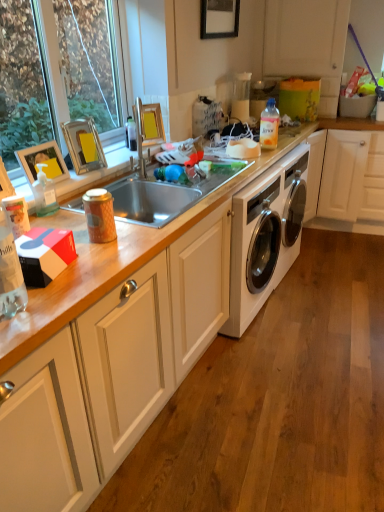
Describe the element at coordinates (269, 125) in the screenshot. The height and width of the screenshot is (512, 384). I see `translucent plastic bottle at upper right, marked as the 1th bottle in a right-to-left arrangement` at that location.

What do you see at coordinates (56, 71) in the screenshot? I see `clear glass window at upper left` at bounding box center [56, 71].

This screenshot has height=512, width=384. What do you see at coordinates (83, 145) in the screenshot? I see `silver metallic picture frame at upper left, marked as the second picture frame in a front-to-back arrangement` at bounding box center [83, 145].

Describe the element at coordinates (150, 123) in the screenshot. I see `yellow cardboard picture frame at upper center, acting as the second picture frame starting from the top` at that location.

I want to click on translucent plastic bottle at upper right, marked as the 1th bottle in a right-to-left arrangement, so 269,125.

From a real-world perspective, which object stands above the other?

From a 3D spatial view, yellow cardboard picture frame at upper center, which appears as the 3th picture frame when viewed from the front, is above.

From the image's perspective, which is below, translucent plastic bottle at upper right, which is counted as the first bottle, starting from the back, or yellow cardboard picture frame at upper center, which appears as the 3th picture frame when viewed from the front?

yellow cardboard picture frame at upper center, which appears as the 3th picture frame when viewed from the front, is shown below in the image.

Considering the relative positions of translucent plastic bottle at upper right, marked as the 1th bottle in a right-to-left arrangement, and yellow cardboard picture frame at upper center, which appears as the 3th picture frame when viewed from the front, in the image provided, is translucent plastic bottle at upper right, marked as the 1th bottle in a right-to-left arrangement, to the right of yellow cardboard picture frame at upper center, which appears as the 3th picture frame when viewed from the front, from the viewer's perspective?

Yes, translucent plastic bottle at upper right, marked as the 1th bottle in a right-to-left arrangement, is to the right of yellow cardboard picture frame at upper center, which appears as the 3th picture frame when viewed from the front.

Considering the points (263, 139) and (151, 110), which point is behind, point (263, 139) or point (151, 110)?

Positioned behind is point (263, 139).

Consider the image. Does metallic silver picture frame at upper left, marked as the first picture frame in a front-to-back arrangement, have a larger size compared to white matte cabinet at upper right, positioned as the 2th cabinetry in bottom-to-top order?

No, metallic silver picture frame at upper left, marked as the first picture frame in a front-to-back arrangement, is not bigger than white matte cabinet at upper right, positioned as the 2th cabinetry in bottom-to-top order.

Would you say metallic silver picture frame at upper left, the fourth picture frame in the right-to-left sequence, is to the left or to the right of white matte cabinet at upper right, positioned as the 2th cabinetry in bottom-to-top order, in the picture?

metallic silver picture frame at upper left, the fourth picture frame in the right-to-left sequence, is positioned on white matte cabinet at upper right, positioned as the 2th cabinetry in bottom-to-top order,'s left side.

How many degrees apart are the facing directions of metallic silver picture frame at upper left, marked as the first picture frame in a front-to-back arrangement, and white matte cabinet at upper right, positioned as the first cabinetry in top-to-bottom order?

The angular difference between metallic silver picture frame at upper left, marked as the first picture frame in a front-to-back arrangement, and white matte cabinet at upper right, positioned as the first cabinetry in top-to-bottom order, is 85.1 degrees.

Based on the photo, based on their positions, is black matte picture frame at upper center, the 4th picture frame ordered from the bottom, located to the left or right of translucent plastic bottle at left, the second bottle positioned from the top?

Clearly, black matte picture frame at upper center, the 4th picture frame ordered from the bottom, is on the right of translucent plastic bottle at left, the second bottle positioned from the top, in the image.

Which object is closer to the camera, black matte picture frame at upper center, the fourth picture frame in the left-to-right sequence, or translucent plastic bottle at left, which appears as the 2th bottle when viewed from the back?

Positioned in front is translucent plastic bottle at left, which appears as the 2th bottle when viewed from the back.

From a real-world perspective, is black matte picture frame at upper center, the 4th picture frame ordered from the bottom, above or below translucent plastic bottle at left, which appears as the 2th bottle when viewed from the back?

Clearly, from a real-world perspective, black matte picture frame at upper center, the 4th picture frame ordered from the bottom, is above translucent plastic bottle at left, which appears as the 2th bottle when viewed from the back.

Between point (236, 31) and point (39, 182), which one is positioned in front?

Point (39, 182)

The width and height of the screenshot is (384, 512). In order to click on cabinetry on the left of translucent plastic bottle at upper right, which appears as the 1th bottle when viewed from the top in this screenshot , I will do (x=111, y=373).

In the scene shown: Considering the sizes of white matte cabinet at lower left, acting as the 1th cabinetry starting from the bottom, and translucent plastic bottle at upper right, which is the second bottle from left to right, in the image, is white matte cabinet at lower left, acting as the 1th cabinetry starting from the bottom, taller or shorter than translucent plastic bottle at upper right, which is the second bottle from left to right,?

white matte cabinet at lower left, acting as the 1th cabinetry starting from the bottom, is shorter than translucent plastic bottle at upper right, which is the second bottle from left to right.

Is point (61, 459) behind point (275, 127)?

No, (61, 459) is in front of (275, 127).

Who is bigger, silver metallic picture frame at upper left, marked as the second picture frame in a front-to-back arrangement, or yellow cardboard picture frame at upper center, placed as the third picture frame when sorted from left to right?

Bigger between the two is silver metallic picture frame at upper left, marked as the second picture frame in a front-to-back arrangement.

From a real-world perspective, is silver metallic picture frame at upper left, the 3th picture frame from the top, physically below yellow cardboard picture frame at upper center, which is counted as the 2th picture frame, starting from the right?

Actually, silver metallic picture frame at upper left, the 3th picture frame from the top, is physically above yellow cardboard picture frame at upper center, which is counted as the 2th picture frame, starting from the right, in the real world.

Between point (83, 160) and point (144, 115), which one is positioned behind?

Positioned behind is point (144, 115).

Is silver metallic picture frame at upper left, positioned as the 3th picture frame in right-to-left order, facing away from yellow cardboard picture frame at upper center, which is counted as the 2th picture frame, starting from the right?

That's not correct — silver metallic picture frame at upper left, positioned as the 3th picture frame in right-to-left order, is not looking away from yellow cardboard picture frame at upper center, which is counted as the 2th picture frame, starting from the right.

How different are the orientations of clear glass window at upper left and translucent plastic bottle at left, the second bottle positioned from the top, in degrees?

clear glass window at upper left and translucent plastic bottle at left, the second bottle positioned from the top, are facing 0.468 degrees away from each other.

From a real-world perspective, which object rests below the other?

translucent plastic bottle at left, the first bottle in the left-to-right sequence, from a real-world perspective.

Considering the sizes of clear glass window at upper left and translucent plastic bottle at left, the second bottle positioned from the top, in the image, is clear glass window at upper left bigger or smaller than translucent plastic bottle at left, the second bottle positioned from the top,?

In the image, clear glass window at upper left appears to be larger than translucent plastic bottle at left, the second bottle positioned from the top.

Is point (164, 392) more distant than point (252, 195)?

No, (164, 392) is in front of (252, 195).

Is white matte cabinet at lower left, acting as the 1th cabinetry starting from the bottom, to the left or to the right of white glossy washing machine at center in the image?

white matte cabinet at lower left, acting as the 1th cabinetry starting from the bottom, is positioned on white glossy washing machine at center's left side.

In the scene shown: Which object is thinner, white matte cabinet at lower left, the 2th cabinetry viewed from the top, or white glossy washing machine at center?

white glossy washing machine at center is thinner.

Identify the location of bottle behind the yellow cardboard picture frame at upper center, which is counted as the 2th picture frame, starting from the right. (269, 125).

Which picture frame is the 4th one when counting from the front of the white matte cabinet at upper right, positioned as the 2th cabinetry in bottom-to-top order? Please provide its 2D coordinates.

[(43, 162)]

Based on their spatial positions, is white matte cabinet at lower left, the 2th cabinetry viewed from the top, or translucent plastic bottle at left, which appears as the 2th bottle when viewed from the back, further from metallic silver picture frame at upper left, the fourth picture frame in the right-to-left sequence?

white matte cabinet at lower left, the 2th cabinetry viewed from the top, is further to metallic silver picture frame at upper left, the fourth picture frame in the right-to-left sequence.

Which object lies nearer to the anchor point white matte cabinet at lower left, acting as the 1th cabinetry starting from the bottom, metallic silver picture frame at upper left, marked as the first picture frame in a bottom-to-top arrangement, or silver metallic picture frame at upper left, which is the 2th picture frame in left-to-right order?

Based on the image, metallic silver picture frame at upper left, marked as the first picture frame in a bottom-to-top arrangement, appears to be nearer to white matte cabinet at lower left, acting as the 1th cabinetry starting from the bottom.

Based on their spatial positions, is white matte cabinet at upper right, positioned as the 2th cabinetry in bottom-to-top order, or black matte picture frame at upper center, which is the 4th picture frame in front-to-back order, closer to silver metallic picture frame at upper left, which is the 2th picture frame in left-to-right order?

Result: Among the two, black matte picture frame at upper center, which is the 4th picture frame in front-to-back order, is located nearer to silver metallic picture frame at upper left, which is the 2th picture frame in left-to-right order.

Estimate the real-world distances between objects in this image. Which object is closer to translucent plastic bottle at upper right, which is counted as the first bottle, starting from the back, black matte picture frame at upper center, which is the 4th picture frame in front-to-back order, or white matte cabinet at lower left, acting as the 1th cabinetry starting from the bottom?

black matte picture frame at upper center, which is the 4th picture frame in front-to-back order, is closer to translucent plastic bottle at upper right, which is counted as the first bottle, starting from the back.

Which object lies nearer to the anchor point yellow cardboard picture frame at upper center, placed as the third picture frame when sorted from left to right, metallic silver picture frame at upper left, which is the 1th picture frame in left-to-right order, or white matte cabinet at lower left, acting as the 1th cabinetry starting from the bottom?

metallic silver picture frame at upper left, which is the 1th picture frame in left-to-right order, lies closer to yellow cardboard picture frame at upper center, placed as the third picture frame when sorted from left to right, than the other object.

Based on their spatial positions, is metallic silver picture frame at upper left, which is the fourth picture frame from back to front, or white matte cabinet at upper right, positioned as the 2th cabinetry in bottom-to-top order, closer to translucent plastic bottle at left, the first bottle in the left-to-right sequence?

The object closer to translucent plastic bottle at left, the first bottle in the left-to-right sequence, is metallic silver picture frame at upper left, which is the fourth picture frame from back to front.

Which object lies further to the anchor point white glossy washing machine at center, yellow cardboard picture frame at upper center, which is counted as the 2th picture frame, starting from the right, or translucent plastic bottle at left, the second bottle positioned from the top?

Among the two, translucent plastic bottle at left, the second bottle positioned from the top, is located further to white glossy washing machine at center.

Estimate the real-world distances between objects in this image. Which object is closer to yellow cardboard picture frame at upper center, placed as the third picture frame when sorted from left to right, black matte picture frame at upper center, acting as the 1th picture frame starting from the back, or clear glass window at upper left?

clear glass window at upper left lies closer to yellow cardboard picture frame at upper center, placed as the third picture frame when sorted from left to right, than the other object.

Where is `washing machine located between metallic silver picture frame at upper left, the fourth picture frame in the right-to-left sequence, and translucent plastic bottle at upper right, which is counted as the second bottle, starting from the front, in the left-right direction`? This screenshot has height=512, width=384. washing machine located between metallic silver picture frame at upper left, the fourth picture frame in the right-to-left sequence, and translucent plastic bottle at upper right, which is counted as the second bottle, starting from the front, in the left-right direction is located at coordinates (265, 236).

I want to click on bottle between white matte cabinet at upper right, positioned as the 2th cabinetry in bottom-to-top order, and white glossy washing machine at center in the up-down direction, so click(x=269, y=125).

Locate an element on the screen. bottle between translucent plastic bottle at left, the first bottle in the left-to-right sequence, and white matte cabinet at upper right, positioned as the 2th cabinetry in bottom-to-top order is located at coordinates (269, 125).

Where is `picture frame between metallic silver picture frame at upper left, the fourth picture frame in the right-to-left sequence, and yellow cardboard picture frame at upper center, placed as the third picture frame when sorted from left to right, in the front-back direction`? picture frame between metallic silver picture frame at upper left, the fourth picture frame in the right-to-left sequence, and yellow cardboard picture frame at upper center, placed as the third picture frame when sorted from left to right, in the front-back direction is located at coordinates (83, 145).